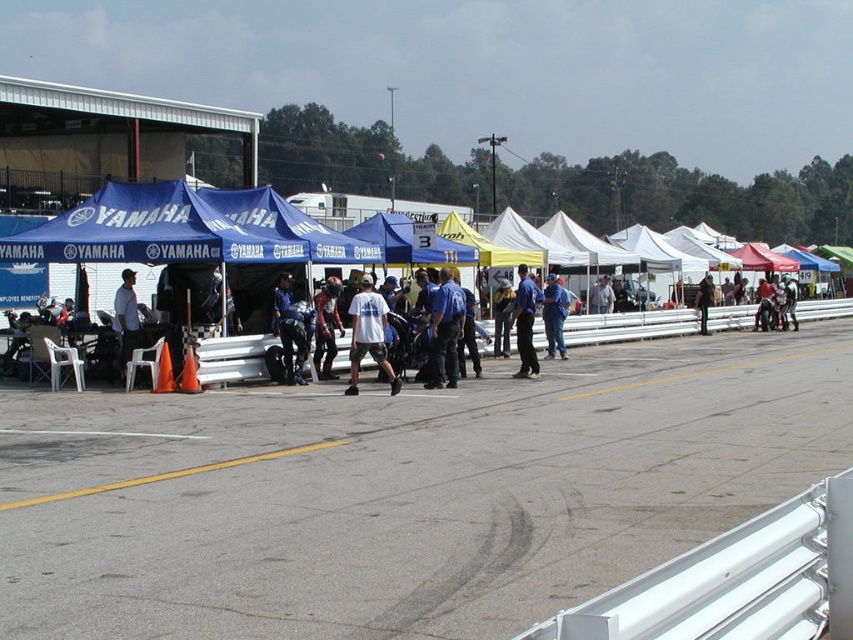
You are a photographer at the Yamaha event and want to capture a photo of the leather jacket at center and the light blue shirt at center. Which one is positioned lower in the image?

The leather jacket at center is below the light blue shirt at center, so the leather jacket at center is positioned lower in the image.